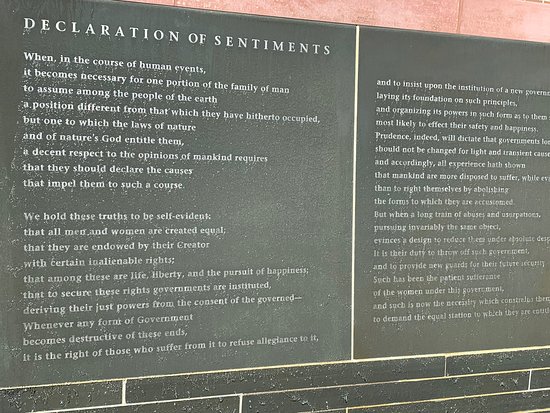
Identify the location of wall. (382, 397).